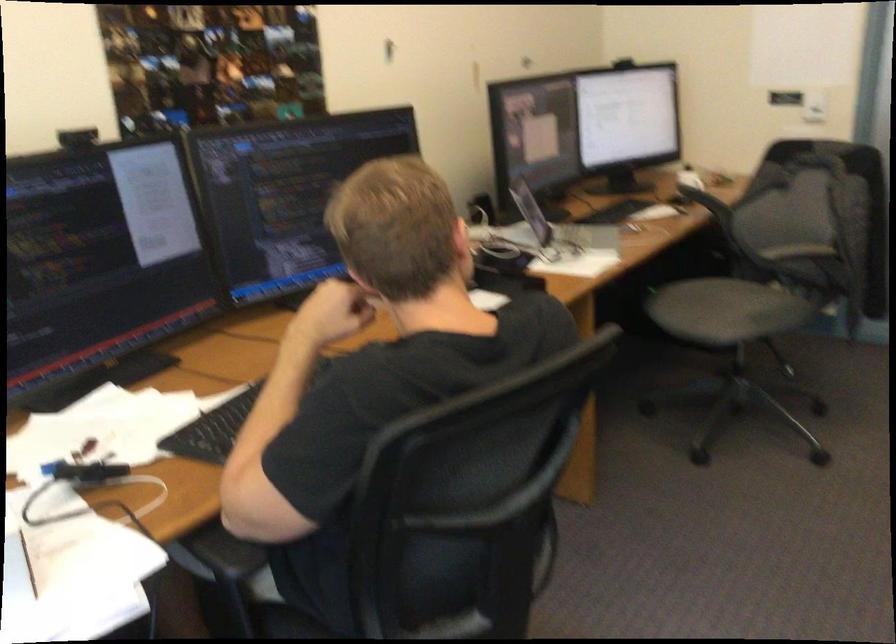
Where would you sit the grey chair sitting surface? Please return your answer as a coordinate pair (x, y).

(709, 308)